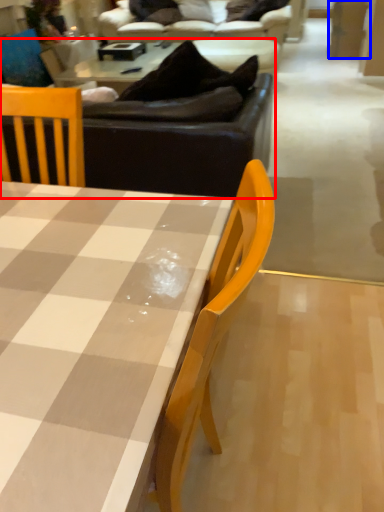
Question: Which object is further to the camera taking this photo, studio couch (highlighted by a red box) or plywood (highlighted by a blue box)?

Choices:
 (A) studio couch
 (B) plywood

Answer: (B)